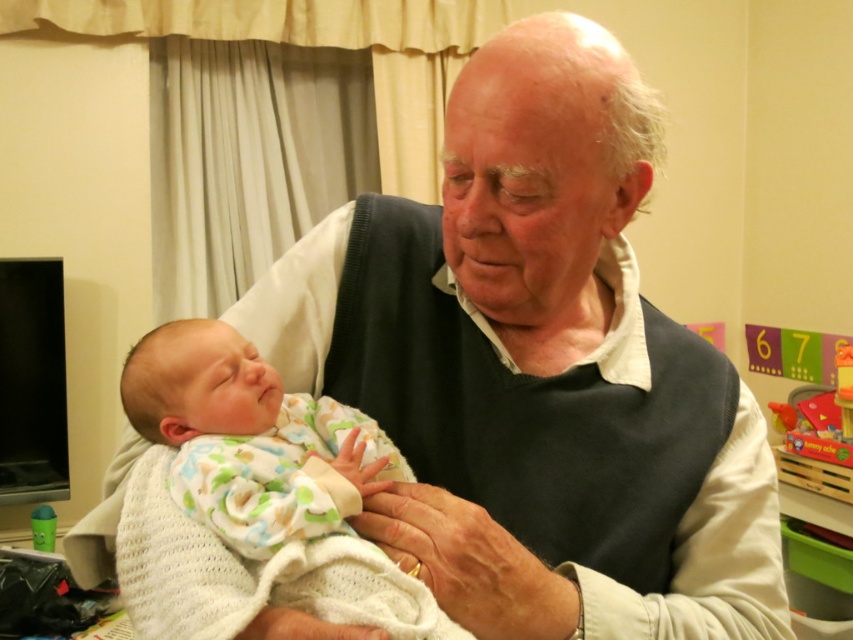
How distant is white knit swaddle at center from dark gray sweater at center?

white knit swaddle at center and dark gray sweater at center are 5.66 inches apart.

Who is positioned more to the right, white knit swaddle at center or dark gray sweater at center?

dark gray sweater at center is more to the right.

Measure the distance between point (300, 429) and camera.

Point (300, 429) is 31.62 inches away from camera.

The image size is (853, 640). Find the location of `white knit swaddle at center`. white knit swaddle at center is located at coordinates (276, 474).